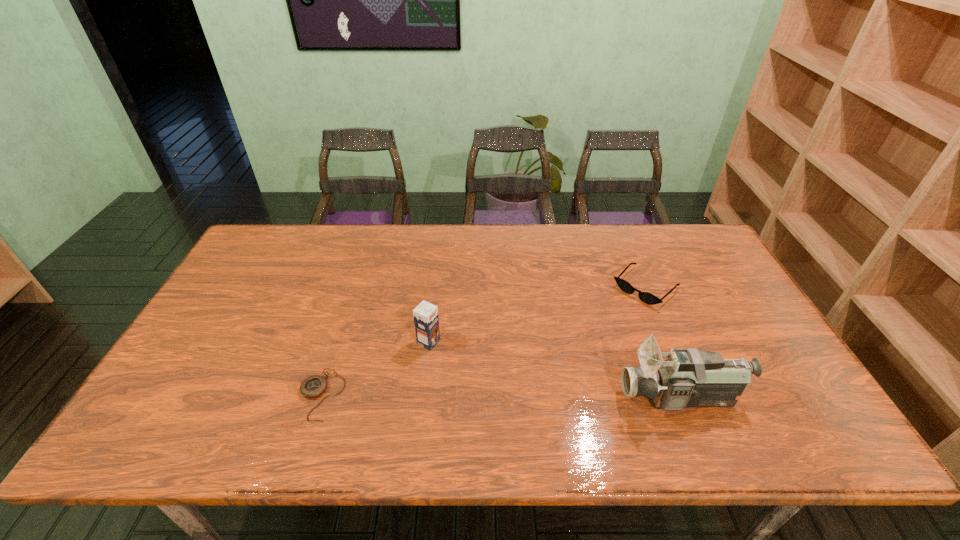
Find the location of a particular element. The width and height of the screenshot is (960, 540). free space that is in between the farthest object and the tallest object is located at coordinates (663, 342).

The image size is (960, 540). I want to click on free space between the shortest object and the farthest object, so click(484, 341).

Where is `blank region between the second farthest object and the camcorder`? The width and height of the screenshot is (960, 540). blank region between the second farthest object and the camcorder is located at coordinates (555, 370).

This screenshot has height=540, width=960. Identify the location of free space between the pocket watch and the third shortest object. (375, 368).

You are a GUI agent. You are given a task and a screenshot of the screen. Output one action in this format:
    pyautogui.click(x=<x>, y=<y>)
    Task: Click on the vacant space in between the camcorder and the sunglasses
    This screenshot has height=540, width=960.
    Given the screenshot: What is the action you would take?
    pyautogui.click(x=663, y=342)

In order to click on free space that is in between the sunglasses and the third object from right to left in this screenshot , I will do `click(538, 315)`.

The width and height of the screenshot is (960, 540). I want to click on free point between the farthest object and the tallest object, so click(x=663, y=342).

This screenshot has width=960, height=540. Find the location of `object that stands as the closest to the tallest object`. object that stands as the closest to the tallest object is located at coordinates (648, 298).

You are a GUI agent. You are given a task and a screenshot of the screen. Output one action in this format:
    pyautogui.click(x=<x>, y=<y>)
    Task: Click on the object that is the second closest one to the camcorder
    The width and height of the screenshot is (960, 540).
    Given the screenshot: What is the action you would take?
    pyautogui.click(x=426, y=320)

Locate an element on the screen. vacant point that satisfies the following two spatial constraints: 1. on the front side of the tallest object; 2. on the front-facing side of the second object from left to right is located at coordinates coord(422,397).